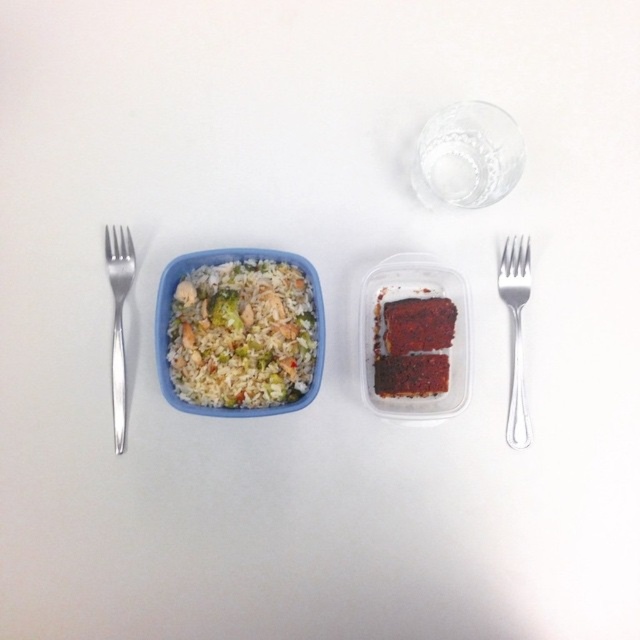
In the scene shown: You are a food critic who needs to choose the appropriate fork for the red velvet cake in the clear plastic container. Which fork should you use, the silver metallic fork at right or the silver metallic fork at left?

The silver metallic fork at left is larger and more suitable for the red velvet cake in the clear plastic container compared to the silver metallic fork at right.